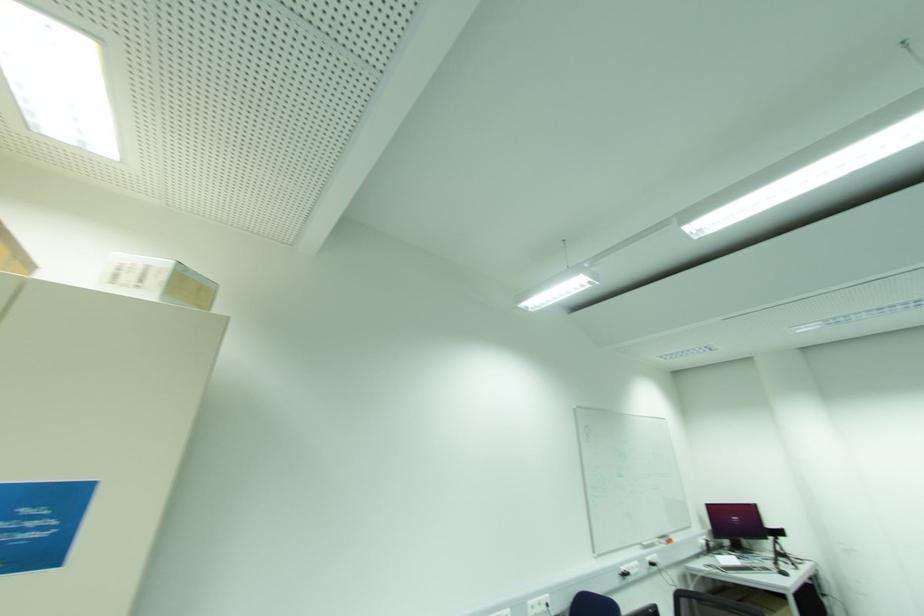
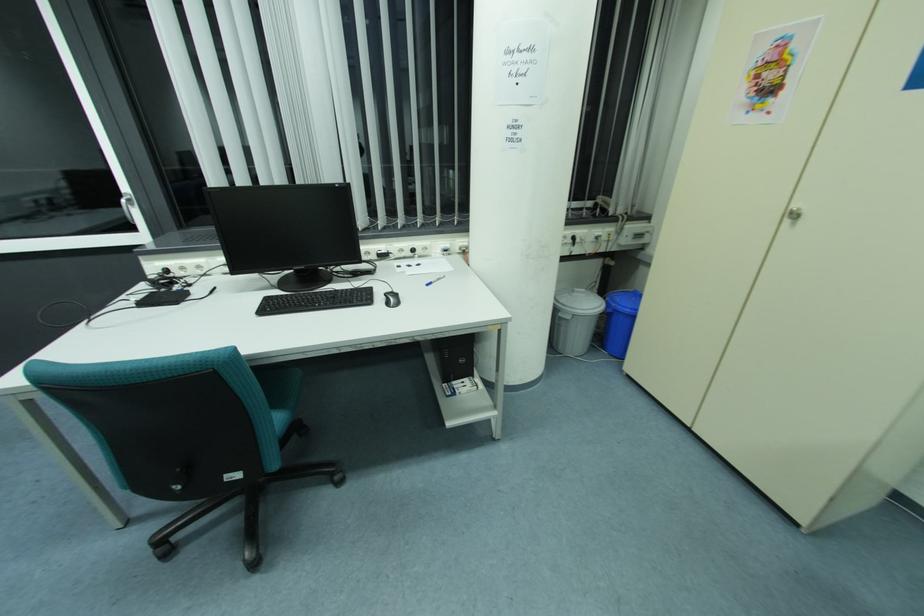
Based on the continuous images, in which direction is the camera rotating?

The rotation direction of the camera is left-down.